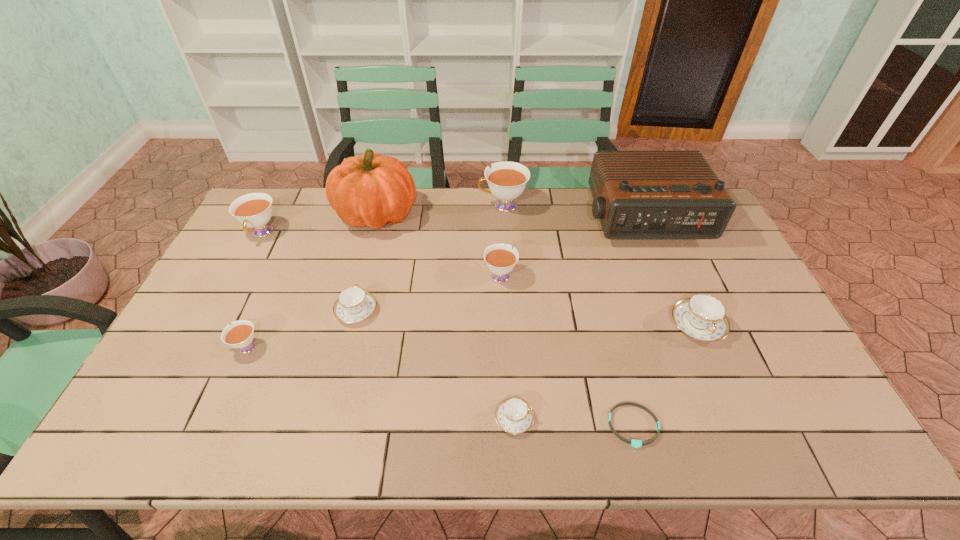
Find the location of a particular element. This screenshot has width=960, height=540. orange pumpkin is located at coordinates (371, 190).

The height and width of the screenshot is (540, 960). In order to click on the tallest object in this screenshot , I will do `click(371, 190)`.

This screenshot has height=540, width=960. What are the coordinates of `brown radio receiver` in the screenshot? It's located at (636, 194).

Identify the location of radio receiver. The width and height of the screenshot is (960, 540). (636, 194).

Where is `the third tallest object`? This screenshot has height=540, width=960. the third tallest object is located at coordinates (507, 180).

At what (x,y) coordinates should I click in order to perform the action: click on the tallest teacup. Please return your answer as a coordinate pair (x, y). The height and width of the screenshot is (540, 960). Looking at the image, I should click on (507, 180).

Where is `the leftmost white teacup`? the leftmost white teacup is located at coordinates (254, 210).

Where is `the leftmost object`? the leftmost object is located at coordinates (254, 210).

Find the location of a particular element. This screenshot has height=540, width=960. the third farthest white teacup is located at coordinates (500, 258).

Identify the location of the third biggest white teacup. (500, 258).